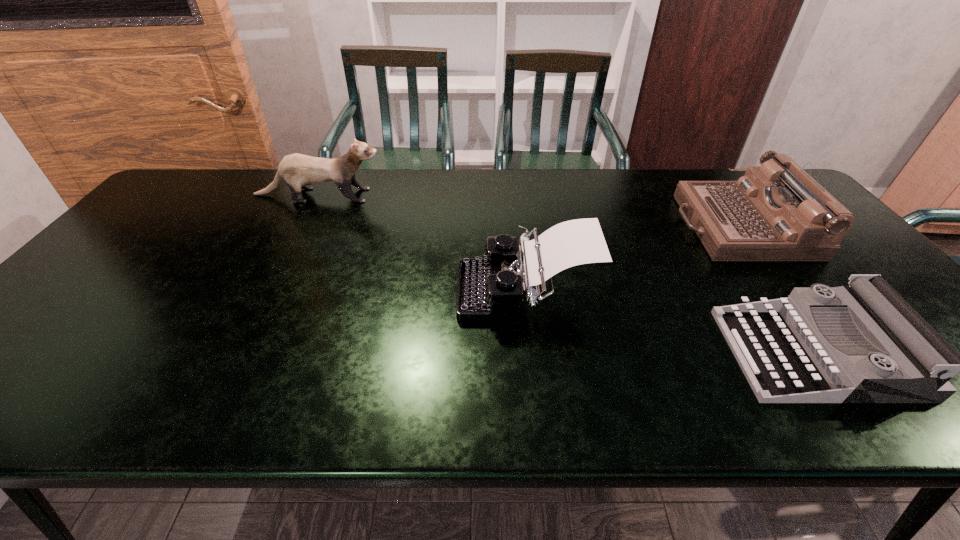
At what (x,y) coordinates should I click in order to perform the action: click on ferret. Please return your answer as a coordinate pair (x, y). The height and width of the screenshot is (540, 960). Looking at the image, I should click on (297, 170).

The width and height of the screenshot is (960, 540). I want to click on the third object from right to left, so click(x=488, y=289).

Find the location of a particular element. The height and width of the screenshot is (540, 960). the shortest typewriter is located at coordinates (786, 358).

You are a GUI agent. You are given a task and a screenshot of the screen. Output one action in this format:
    pyautogui.click(x=<x>, y=<y>)
    Task: Click on the free space located 0.240m on the face of the ferret
    The image size is (960, 540).
    Given the screenshot: What is the action you would take?
    pyautogui.click(x=458, y=195)

The image size is (960, 540). Find the location of `vacant space located 0.300m on the keys of the leftmost typewriter`. vacant space located 0.300m on the keys of the leftmost typewriter is located at coordinates (337, 291).

You are a GUI agent. You are given a task and a screenshot of the screen. Output one action in this format:
    pyautogui.click(x=<x>, y=<y>)
    Task: Click on the free space located on the keys of the leftmost typewriter
    
    Given the screenshot: What is the action you would take?
    pyautogui.click(x=421, y=291)

Where is `vacant space located on the keys of the leftmost typewriter`? This screenshot has width=960, height=540. vacant space located on the keys of the leftmost typewriter is located at coordinates (309, 291).

This screenshot has width=960, height=540. I want to click on free space located 0.240m on the typing side of the shortest object, so click(622, 353).

Where is `free space located on the typing side of the shortest object`? The image size is (960, 540). free space located on the typing side of the shortest object is located at coordinates (563, 353).

This screenshot has height=540, width=960. I want to click on vacant position located on the typing side of the shortest object, so click(709, 353).